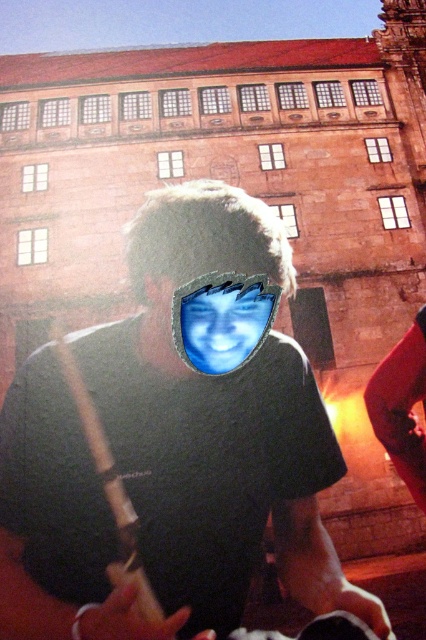
Question: Considering the relative positions of black matte shirt at center and blue matte face at center in the image provided, where is black matte shirt at center located with respect to blue matte face at center?

Choices:
 (A) left
 (B) right

Answer: (A)

Question: Which object is farther from the camera taking this photo?

Choices:
 (A) blue matte face at center
 (B) black matte shirt at center

Answer: (A)

Question: Does black matte shirt at center appear on the right side of blue matte face at center?

Choices:
 (A) no
 (B) yes

Answer: (A)

Question: Which of the following is the closest to the observer?

Choices:
 (A) black matte shirt at center
 (B) blue matte face at center

Answer: (A)

Question: Is black matte shirt at center smaller than blue matte face at center?

Choices:
 (A) yes
 (B) no

Answer: (B)